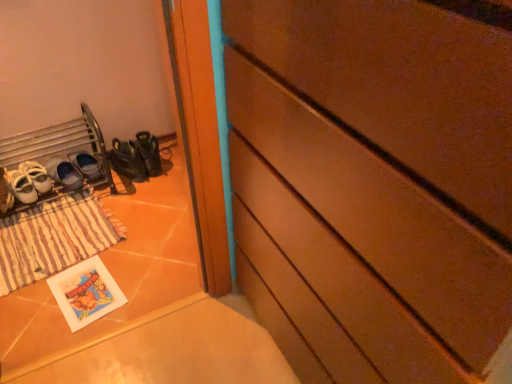
What do you see at coordinates (136, 157) in the screenshot? The image size is (512, 384). I see `matte black shoes at lower left, which is counted as the 4th footwear, starting from the left` at bounding box center [136, 157].

I want to click on white leather shoes at left, the second footwear viewed from the left, so click(37, 176).

Measure the distance between point (74,199) and camera.

Point (74,199) is 2.01 meters from camera.

What are the coordinates of `brown striped mat at lower left` in the screenshot? It's located at (54, 238).

Where is `matte paper postcard at lower left`? matte paper postcard at lower left is located at coordinates (86, 292).

The width and height of the screenshot is (512, 384). I want to click on white leather shoes at left, which is counted as the first footwear, starting from the left, so click(x=5, y=194).

Does matte paper postcard at lower left have a greater height compared to brown matte chest of drawers at center?

No, matte paper postcard at lower left is not taller than brown matte chest of drawers at center.

Image resolution: width=512 pixels, height=384 pixels. I want to click on postcard directly beneath the brown matte chest of drawers at center (from a real-world perspective), so click(86, 292).

Who is bigger, matte paper postcard at lower left or brown matte chest of drawers at center?

With larger size is brown matte chest of drawers at center.

Would you say white leather shoes at left, the fourth footwear from the right, is part of white leather shoes at left, placed as the 3th footwear when sorted from right to left,'s contents?

No, white leather shoes at left, the fourth footwear from the right, is not a part of white leather shoes at left, placed as the 3th footwear when sorted from right to left.

Is white leather shoes at left, placed as the 3th footwear when sorted from right to left, facing towards white leather shoes at left, which is counted as the first footwear, starting from the left?

No, white leather shoes at left, placed as the 3th footwear when sorted from right to left, is not aimed at white leather shoes at left, which is counted as the first footwear, starting from the left.

Can you tell me how much white leather shoes at left, placed as the 3th footwear when sorted from right to left, and white leather shoes at left, which is counted as the first footwear, starting from the left, differ in facing direction?

0.000321 degrees.

Find the location of a particular element. footwear below the white leather shoes at left, placed as the 3th footwear when sorted from right to left (from the image's perspective) is located at coordinates (5, 194).

Would you say brown striped mat at lower left is inside or outside white leather shoes at left, positioned as the 2th footwear in right-to-left order?

brown striped mat at lower left cannot be found inside white leather shoes at left, positioned as the 2th footwear in right-to-left order.

From the picture: Which object is positioned more to the left, brown striped mat at lower left or white leather shoes at left, placed as the 3th footwear when sorted from left to right?

Positioned to the left is white leather shoes at left, placed as the 3th footwear when sorted from left to right.

From the image's perspective, which one is positioned lower, brown striped mat at lower left or white leather shoes at left, positioned as the 2th footwear in right-to-left order?

brown striped mat at lower left appears lower in the image.

Could you tell me if brown striped mat at lower left is facing white leather shoes at left, placed as the 3th footwear when sorted from left to right?

No, brown striped mat at lower left is not turned towards white leather shoes at left, placed as the 3th footwear when sorted from left to right.

From a real-world perspective, between matte paper postcard at lower left and green rubber boots at lower left, who is vertically higher?

green rubber boots at lower left, from a real-world perspective.

Is matte paper postcard at lower left taller or shorter than green rubber boots at lower left?

Considering their sizes, matte paper postcard at lower left has less height than green rubber boots at lower left.

How far apart are matte paper postcard at lower left and green rubber boots at lower left?

The distance of matte paper postcard at lower left from green rubber boots at lower left is 27.44 inches.

The image size is (512, 384). Find the location of `postcard located underneath the green rubber boots at lower left (from a real-world perspective)`. postcard located underneath the green rubber boots at lower left (from a real-world perspective) is located at coordinates (86, 292).

Consider the image. From the image's perspective, which one is positioned higher, brown striped mat at lower left or green rubber boots at lower left?

A: green rubber boots at lower left, from the image's perspective.

What are the coordinates of `shoe located behind the brown striped mat at lower left` in the screenshot? It's located at (149, 153).

Is brown striped mat at lower left touching green rubber boots at lower left?

No, brown striped mat at lower left is not with green rubber boots at lower left.

Is brown striped mat at lower left not within green rubber boots at lower left?

Yes, brown striped mat at lower left is located beyond the bounds of green rubber boots at lower left.

How many degrees apart are the facing directions of matte paper postcard at lower left and white leather shoes at left, placed as the 3th footwear when sorted from right to left?

9.01 degrees separate the facing orientations of matte paper postcard at lower left and white leather shoes at left, placed as the 3th footwear when sorted from right to left.

Is matte paper postcard at lower left not inside white leather shoes at left, the second footwear viewed from the left?

Absolutely, matte paper postcard at lower left is external to white leather shoes at left, the second footwear viewed from the left.

Is point (81, 308) closer or farther from the camera than point (22, 163)?

Point (81, 308).

Does matte paper postcard at lower left turn towards white leather shoes at left, the second footwear viewed from the left?

No.

From the image's perspective, is matte black shoes at lower left, which is counted as the 4th footwear, starting from the left, above or below white leather shoes at left, placed as the 3th footwear when sorted from right to left?

Based on their image positions, matte black shoes at lower left, which is counted as the 4th footwear, starting from the left, is located above white leather shoes at left, placed as the 3th footwear when sorted from right to left.

Can you see matte black shoes at lower left, which is counted as the 4th footwear, starting from the left, touching white leather shoes at left, the second footwear viewed from the left?

matte black shoes at lower left, which is counted as the 4th footwear, starting from the left, and white leather shoes at left, the second footwear viewed from the left, are not in contact.

Is matte black shoes at lower left, which is counted as the 4th footwear, starting from the left, facing towards white leather shoes at left, the second footwear viewed from the left?

No, matte black shoes at lower left, which is counted as the 4th footwear, starting from the left, is not turned towards white leather shoes at left, the second footwear viewed from the left.

Is matte black shoes at lower left, which is counted as the 4th footwear, starting from the left, not inside white leather shoes at left, the second footwear viewed from the left?

Yes, matte black shoes at lower left, which is counted as the 4th footwear, starting from the left, is located beyond the bounds of white leather shoes at left, the second footwear viewed from the left.

The height and width of the screenshot is (384, 512). In order to click on the chest of drawers located in front of the matte paper postcard at lower left in this screenshot , I will do `click(378, 177)`.

At what (x,y) coordinates should I click in order to perform the action: click on footwear below the white leather shoes at left, placed as the 3th footwear when sorted from right to left (from the image's perspective). Please return your answer as a coordinate pair (x, y). Looking at the image, I should click on (5, 194).

Looking at the image, which one is located further to brown striped mat at lower left, white leather shoes at left, the second footwear viewed from the left, or matte black shoes at lower left, the first footwear when ordered from right to left?

Among the two, matte black shoes at lower left, the first footwear when ordered from right to left, is located further to brown striped mat at lower left.

Looking at this image, when comparing their distances from brown striped mat at lower left, does matte black shoes at lower left, the first footwear when ordered from right to left, or white leather shoes at left, the fourth footwear from the right, seem closer?

Based on the image, white leather shoes at left, the fourth footwear from the right, appears to be nearer to brown striped mat at lower left.

From the image, which object appears to be nearer to white leather shoes at left, placed as the 3th footwear when sorted from right to left, brown matte chest of drawers at center or matte paper postcard at lower left?

The object closer to white leather shoes at left, placed as the 3th footwear when sorted from right to left, is matte paper postcard at lower left.

Which object lies nearer to the anchor point white leather shoes at left, which is counted as the first footwear, starting from the left, white leather shoes at left, positioned as the 2th footwear in right-to-left order, or matte black shoes at lower left, the first footwear when ordered from right to left?

white leather shoes at left, positioned as the 2th footwear in right-to-left order, is closer to white leather shoes at left, which is counted as the first footwear, starting from the left.

Estimate the real-world distances between objects in this image. Which object is closer to white leather shoes at left, placed as the 3th footwear when sorted from right to left, matte black shoes at lower left, the first footwear when ordered from right to left, or white leather shoes at left, the fourth footwear from the right?

Among the two, white leather shoes at left, the fourth footwear from the right, is located nearer to white leather shoes at left, placed as the 3th footwear when sorted from right to left.

Which object lies further to the anchor point white leather shoes at left, positioned as the 2th footwear in right-to-left order, brown matte chest of drawers at center or brown striped mat at lower left?

The object further to white leather shoes at left, positioned as the 2th footwear in right-to-left order, is brown matte chest of drawers at center.

Which object lies nearer to the anchor point white leather shoes at left, which is counted as the first footwear, starting from the left, matte paper postcard at lower left or green rubber boots at lower left?

green rubber boots at lower left is positioned closer to the anchor white leather shoes at left, which is counted as the first footwear, starting from the left.

From the image, which object appears to be farther from white leather shoes at left, placed as the 3th footwear when sorted from left to right, brown matte chest of drawers at center or white leather shoes at left, the fourth footwear from the right?

brown matte chest of drawers at center is positioned further to the anchor white leather shoes at left, placed as the 3th footwear when sorted from left to right.

Where is `mat located between white leather shoes at left, placed as the 3th footwear when sorted from right to left, and matte paper postcard at lower left in the left-right direction`? mat located between white leather shoes at left, placed as the 3th footwear when sorted from right to left, and matte paper postcard at lower left in the left-right direction is located at coordinates point(54,238).

The image size is (512, 384). In order to click on mat between white leather shoes at left, placed as the 3th footwear when sorted from right to left, and green rubber boots at lower left, in the horizontal direction in this screenshot , I will do `click(54, 238)`.

Locate an element on the screen. The image size is (512, 384). postcard situated between white leather shoes at left, the fourth footwear from the right, and green rubber boots at lower left from left to right is located at coordinates (86, 292).

Image resolution: width=512 pixels, height=384 pixels. I want to click on mat between white leather shoes at left, which is counted as the first footwear, starting from the left, and matte black shoes at lower left, which is counted as the 4th footwear, starting from the left, from left to right, so click(x=54, y=238).